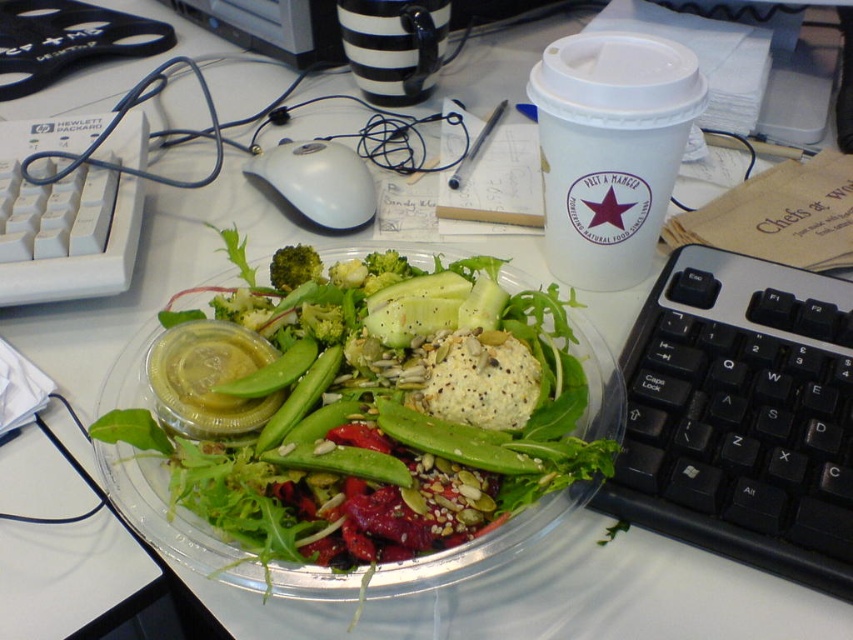
In the scene shown: You have a small container that can only hold items narrower than the green broccoli at center. Can the translucent plastic salad at center fit into the container?

The translucent plastic salad at center is wider than the green broccoli at center, so it cannot fit into the container designed for items narrower than the broccoli.

Please provide the coordinates of the translucent plastic salad at center in the image. Use the format of x and y values between 0 and 1, where the origin is the top left corner of the image. The answer should be in the form of a tuple with two decimal numbers, like this example format for coordinates at the center of the image would be written as 0.5, 0.5. Please do not add any extra text or explanation, just the coordinates in the format of two decimal numbers separated by a comma.

(354,442)